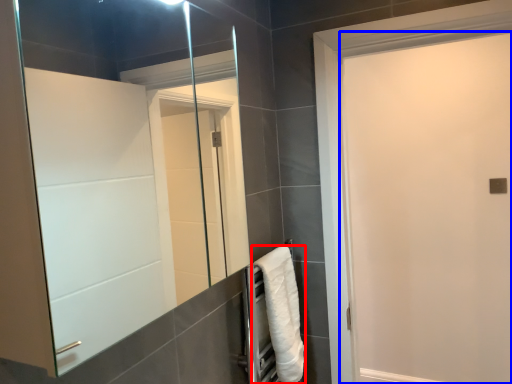
Question: Among these objects, which one is nearest to the camera, towel (highlighted by a red box) or screen door (highlighted by a blue box)?

Choices:
 (A) towel
 (B) screen door

Answer: (B)